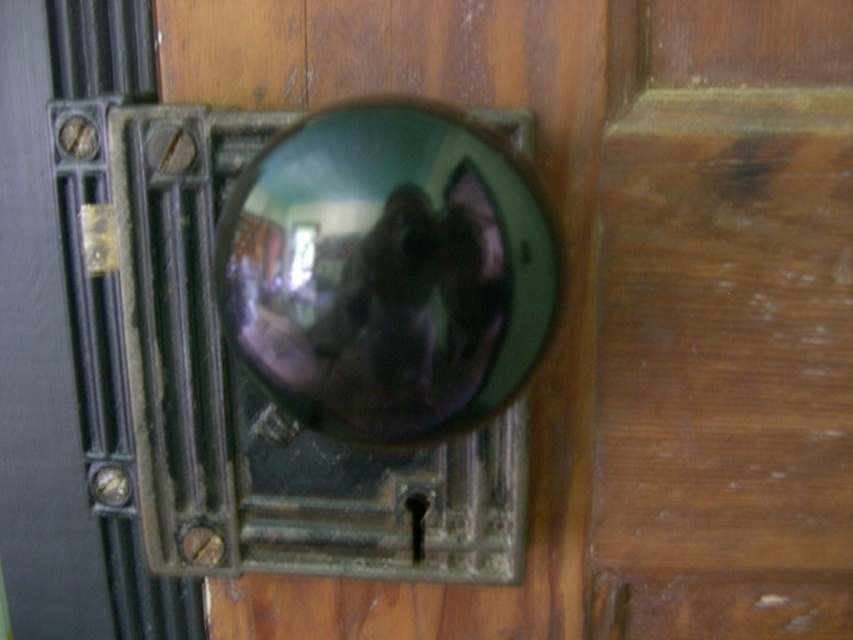
You are a locksmith examining a door with two handles. You see a shiny green knob at center and a glossy metallic sphere at center. Which handle is positioned to the left?

The shiny green knob at center is positioned to the left of the glossy metallic sphere at center.

You are trying to open the door but can only reach up to 1.5 meters. The shiny green knob at center and the glossy metallic sphere at center are both on the door. Which one is within your reach?

The glossy metallic sphere at center is shorter than the shiny green knob at center. Since the shiny green knob at center is taller, it might be out of reach if it is above 1.5 meters. However, the glossy metallic sphere at center being shorter could be within your reach. But without knowing their exact heights, we cannot determine for sure. However, based on the given information, the glossy metallic sphere at center is shorter, so it is more likely within reach.

You are a locksmith trying to install a new door handle. You have two options to choose from. The first is the shiny green knob at center, and the second is the glossy metallic sphere at center. The existing door has a rectangular frame that can only accommodate one of them. Which one will fit better based on their positions?

The shiny green knob at center and glossy metallic sphere at center are 5.64 inches apart. Since the door frame can only accommodate one, the one that is positioned at the center will fit better. However, since both are at the center, you need to choose based on their size or other factors not mentioned here.